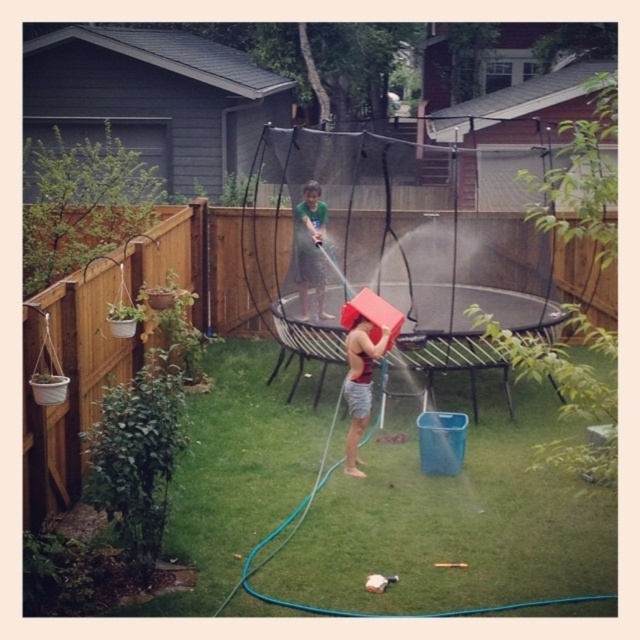
Question: Which point appears farthest from the camera in this image?

Choices:
 (A) (323, 272)
 (B) (376, 342)

Answer: (A)

Question: Does matte red bucket at center appear under green fabric shirt at center?

Choices:
 (A) no
 (B) yes

Answer: (B)

Question: Considering the relative positions of matte red bucket at center and green fabric shirt at center in the image provided, where is matte red bucket at center located with respect to green fabric shirt at center?

Choices:
 (A) below
 (B) above

Answer: (A)

Question: Among these objects, which one is farthest from the camera?

Choices:
 (A) matte red bucket at center
 (B) green fabric shirt at center

Answer: (B)

Question: Does matte red bucket at center have a lesser width compared to green fabric shirt at center?

Choices:
 (A) no
 (B) yes

Answer: (B)